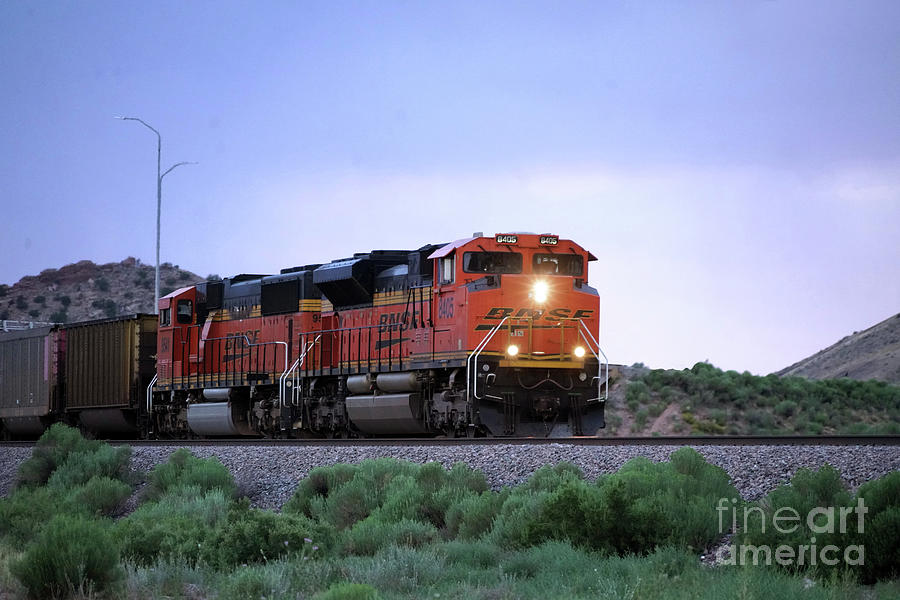
Locate an element on the screen. Image resolution: width=900 pixels, height=600 pixels. lamp is located at coordinates (192, 163), (122, 121).